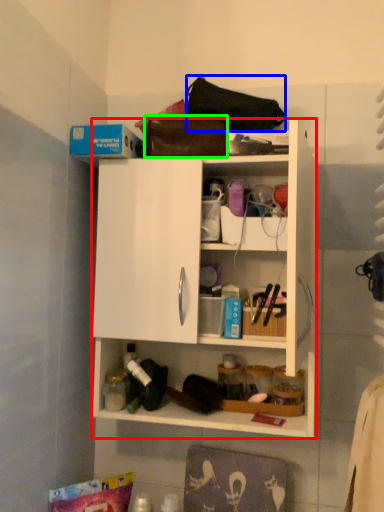
Question: Considering the real-world distances, which object is closest to cabinetry (highlighted by a red box)? handbag (highlighted by a blue box) or handbag (highlighted by a green box).

Choices:
 (A) handbag
 (B) handbag

Answer: (B)